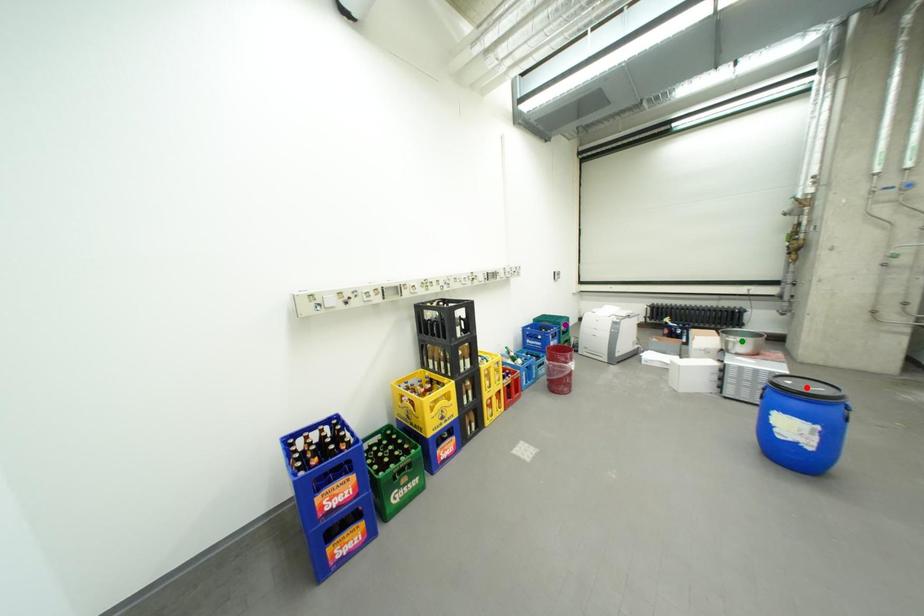
Order these from nearest to farthest:
red point, green point, purple point

red point < green point < purple point